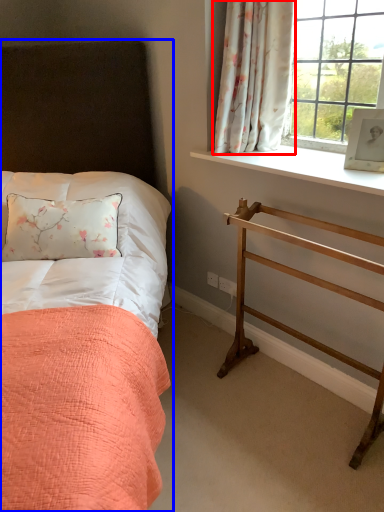
Question: Among these objects, which one is farthest to the camera, curtain (highlighted by a red box) or bed (highlighted by a blue box)?

Choices:
 (A) curtain
 (B) bed

Answer: (A)